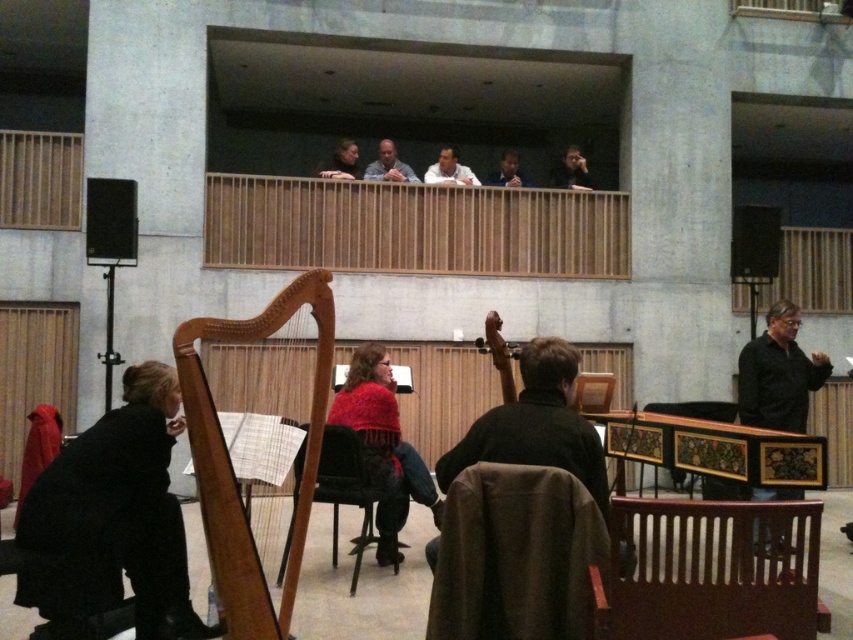
Image resolution: width=853 pixels, height=640 pixels. What do you see at coordinates (450, 170) in the screenshot? I see `white shirt at upper center` at bounding box center [450, 170].

Which of these two, white shirt at upper center or matte black laptop at upper center, stands taller?

Standing taller between the two is white shirt at upper center.

Is point (434, 180) positioned behind point (328, 166)?

That is False.

I want to click on white shirt at upper center, so click(x=450, y=170).

Find the location of `wooden chair at center`. wooden chair at center is located at coordinates (593, 392).

Who is more forward, (604,396) or (488,337)?

Point (488,337) is in front.

Where is `wooden chair at center`? The width and height of the screenshot is (853, 640). wooden chair at center is located at coordinates (593, 392).

Does point (561, 518) lie behind point (498, 321)?

That is False.

Between point (556, 612) and point (496, 337), which one is positioned behind?

The point (496, 337) is behind.

This screenshot has height=640, width=853. I want to click on brown fabric chair at center, so click(515, 556).